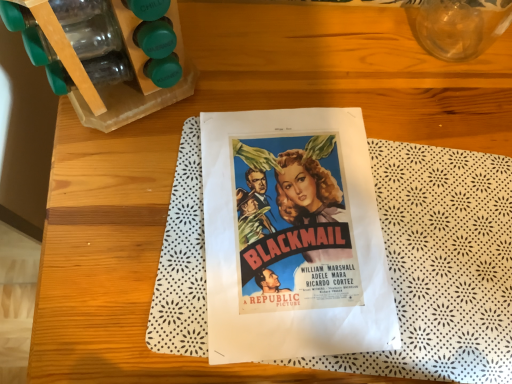
Where is `vacant space that's between transparent glass vase at upper right and vivid paper poster at center`? The width and height of the screenshot is (512, 384). vacant space that's between transparent glass vase at upper right and vivid paper poster at center is located at coordinates (389, 134).